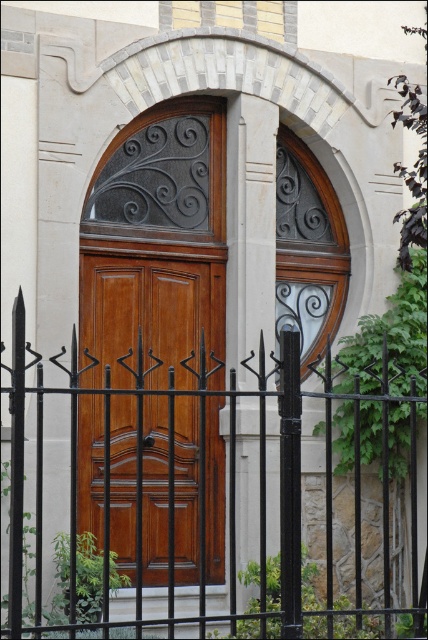
Does black wrought iron fence at center appear under wooden door at center?

Indeed, black wrought iron fence at center is positioned under wooden door at center.

Which is in front, point (385, 426) or point (98, 317)?

Point (385, 426)

Is point (356, 564) positioned in front of point (157, 285)?

Yes, point (356, 564) is closer to viewer.

Where is `black wrought iron fence at center`? The height and width of the screenshot is (640, 428). black wrought iron fence at center is located at coordinates (205, 476).